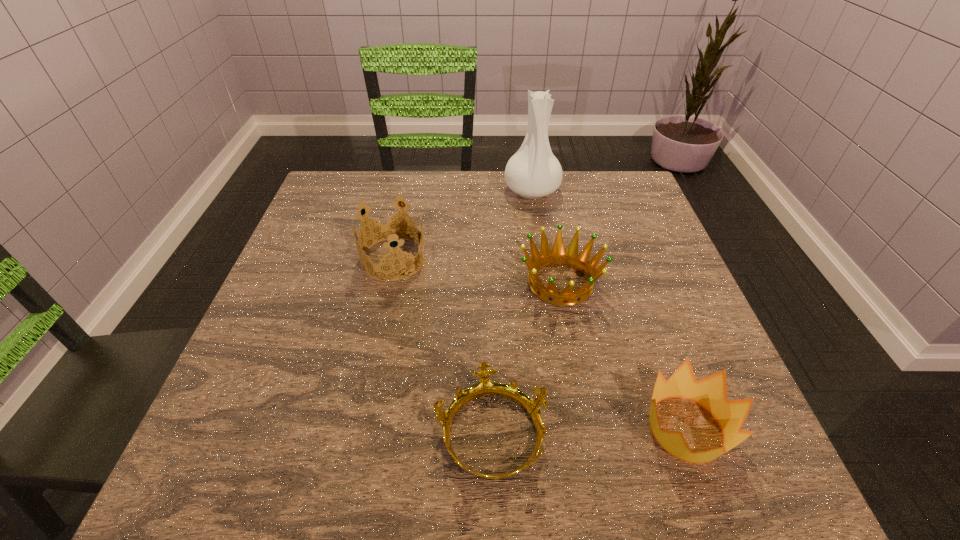
You are a GUI agent. You are given a task and a screenshot of the screen. Output one action in this format:
    pyautogui.click(x=<x>, y=<y>)
    Task: Click on the vase
    This screenshot has height=540, width=960.
    Given the screenshot: What is the action you would take?
    pyautogui.click(x=533, y=172)

Locate an element on the screen. the tallest object is located at coordinates (533, 172).

Identify the location of the leftmost object. (388, 231).

At what (x,y) coordinates should I click in order to perform the action: click on the tallest crown. Please return your answer as a coordinate pair (x, y). Image resolution: width=960 pixels, height=540 pixels. Looking at the image, I should click on (388, 231).

Where is `the shortest object`? The image size is (960, 540). the shortest object is located at coordinates (485, 387).

Locate an element on the screen. free space located on the front of the vase is located at coordinates (546, 285).

Find the location of a particular element. free spot located on the left of the leftmost crown is located at coordinates (323, 259).

The image size is (960, 540). In order to click on vacant space situated 0.120m on the right of the shortest object in this screenshot , I will do `click(620, 433)`.

Identify the location of object that is at the far edge. The image size is (960, 540). (533, 172).

The image size is (960, 540). I want to click on object located at the right edge, so click(710, 392).